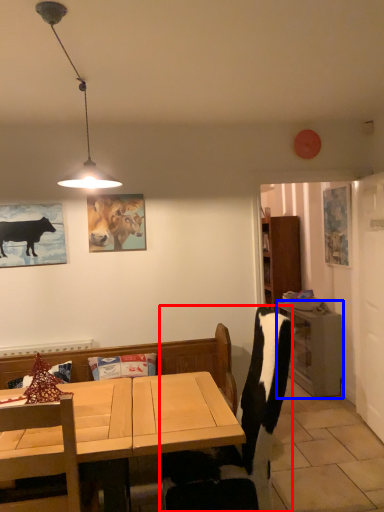
Question: Which object is closer to the camera taking this photo, chair (highlighted by a red box) or table (highlighted by a blue box)?

Choices:
 (A) chair
 (B) table

Answer: (A)